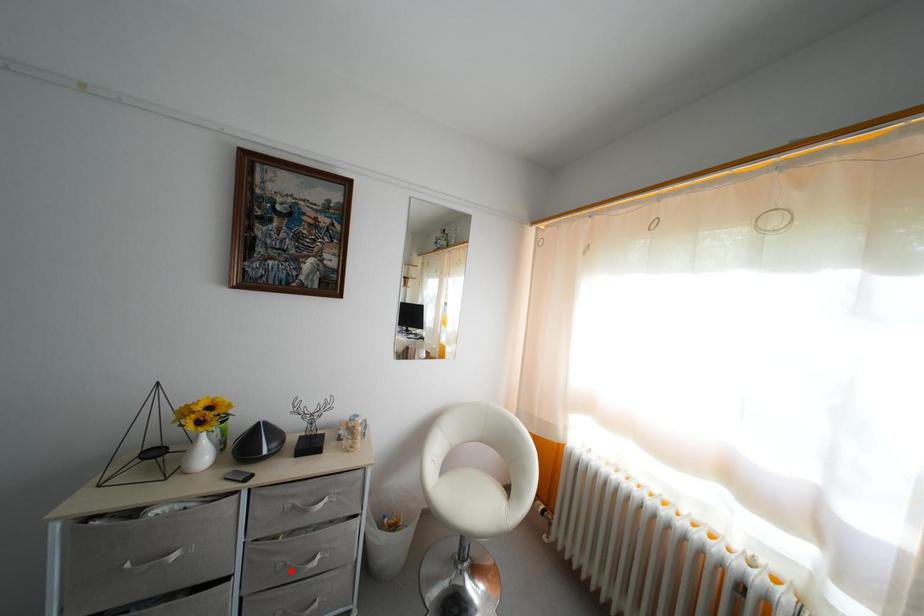
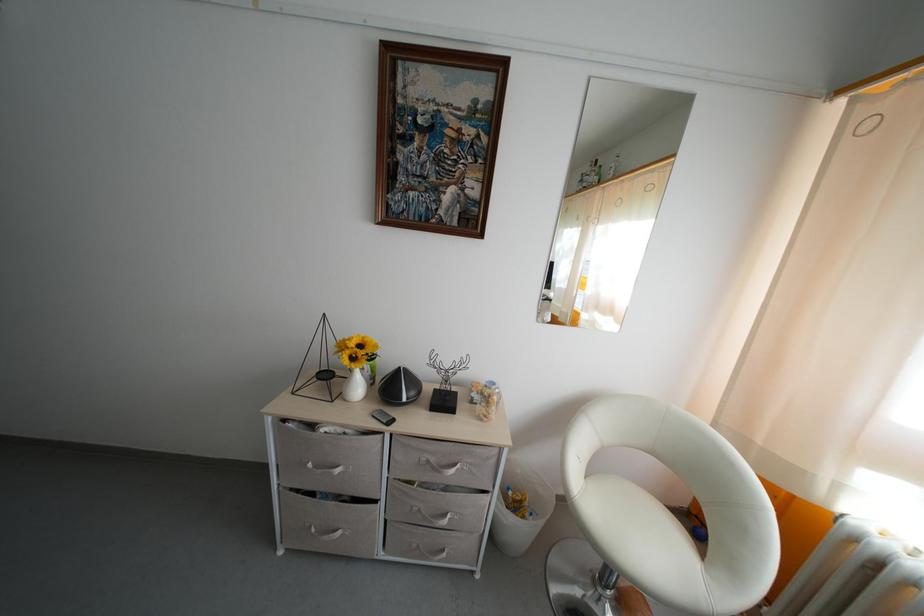
Question: I am providing you with two images of the same scene from different viewpoints. A red point is shown in image1. For the corresponding object point in image2, is it positioned nearer or farther from the camera?

Choices:
 (A) Nearer
 (B) Farther

Answer: (B)